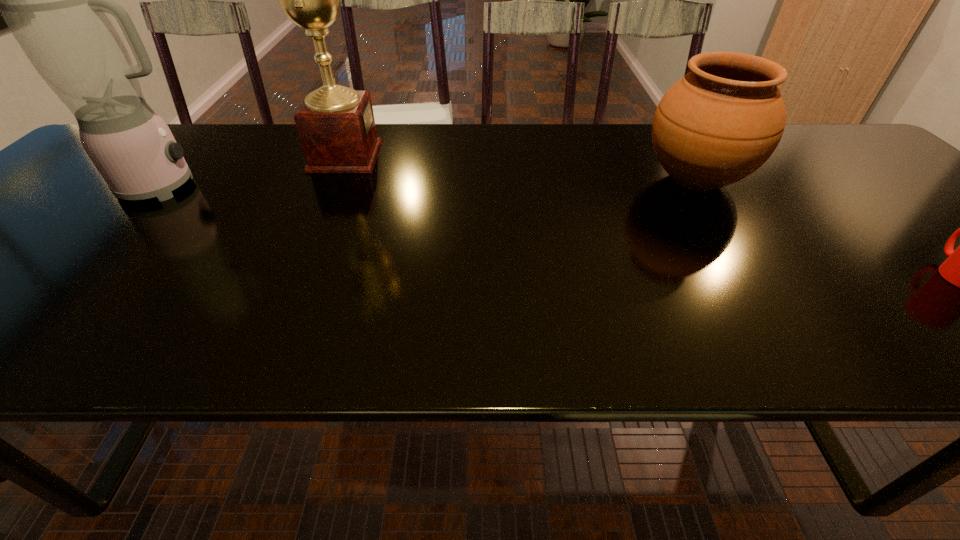
You are a GUI agent. You are given a task and a screenshot of the screen. Output one action in this format:
    pyautogui.click(x=<x>, y=<y>)
    Task: Click on the trophy cup
    This screenshot has height=540, width=960.
    Given the screenshot: What is the action you would take?
    pyautogui.click(x=336, y=126)

Identify the location of the third shortest object. The height and width of the screenshot is (540, 960). (56, 0).

The image size is (960, 540). What are the coordinates of `the leftmost object` in the screenshot? It's located at (56, 0).

Where is `the third object from left to right`? The width and height of the screenshot is (960, 540). the third object from left to right is located at coordinates (722, 121).

Locate an element on the screen. Image resolution: width=960 pixels, height=540 pixels. pottery is located at coordinates (722, 121).

Image resolution: width=960 pixels, height=540 pixels. I want to click on vacant space located on the plaque of the trophy cup, so click(x=435, y=156).

At what (x,y) coordinates should I click in order to perform the action: click on vacant area located on the base of the leftmost object near the control knob. Please return your answer as a coordinate pair (x, y). Looking at the image, I should click on (352, 186).

At what (x,y) coordinates should I click in order to perform the action: click on vacant space located on the front of the second object from right to left. Please return your answer as a coordinate pair (x, y). Image resolution: width=960 pixels, height=540 pixels. Looking at the image, I should click on (773, 302).

The height and width of the screenshot is (540, 960). I want to click on trophy cup that is positioned at the far edge, so click(336, 126).

You are a GUI agent. You are given a task and a screenshot of the screen. Output one action in this format:
    pyautogui.click(x=<x>, y=<y>)
    Task: Click on the pottery at the far edge
    This screenshot has height=540, width=960.
    Given the screenshot: What is the action you would take?
    pyautogui.click(x=722, y=121)